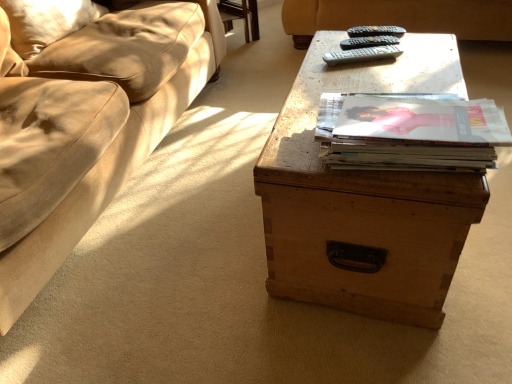
Find the location of a particular element. This screenshot has height=384, width=512. vacant space to the left of gray plastic remote at upper center, which ranks as the 3th remote in top-to-bottom order is located at coordinates (320, 62).